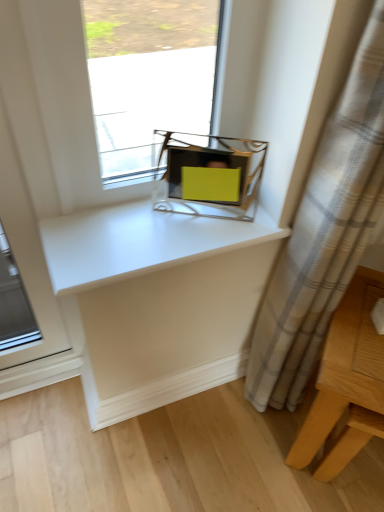
Question: From a real-world perspective, relative to light wood table at lower right, is matte yellow plastic at center vertically above or below?

Choices:
 (A) above
 (B) below

Answer: (A)

Question: From the image's perspective, is matte yellow plastic at center above or below light wood table at lower right?

Choices:
 (A) below
 (B) above

Answer: (B)

Question: Which of these objects is positioned closest to the light wood table at lower right?

Choices:
 (A) matte yellow plastic at center
 (B) white glossy counter top at center

Answer: (B)

Question: Which object is the closest to the light wood table at lower right?

Choices:
 (A) white glossy counter top at center
 (B) matte yellow plastic at center

Answer: (A)